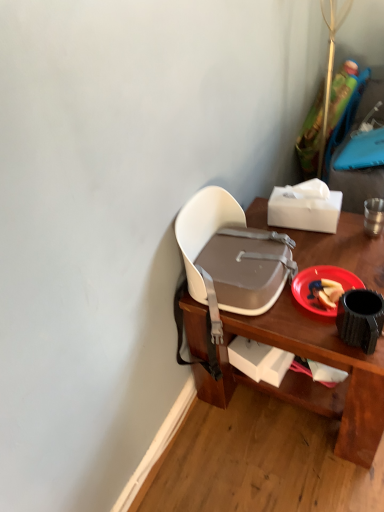
This screenshot has width=384, height=512. I want to click on free space in front of white matte tissue box at upper right, the second box in the bottom-to-top sequence, so click(327, 246).